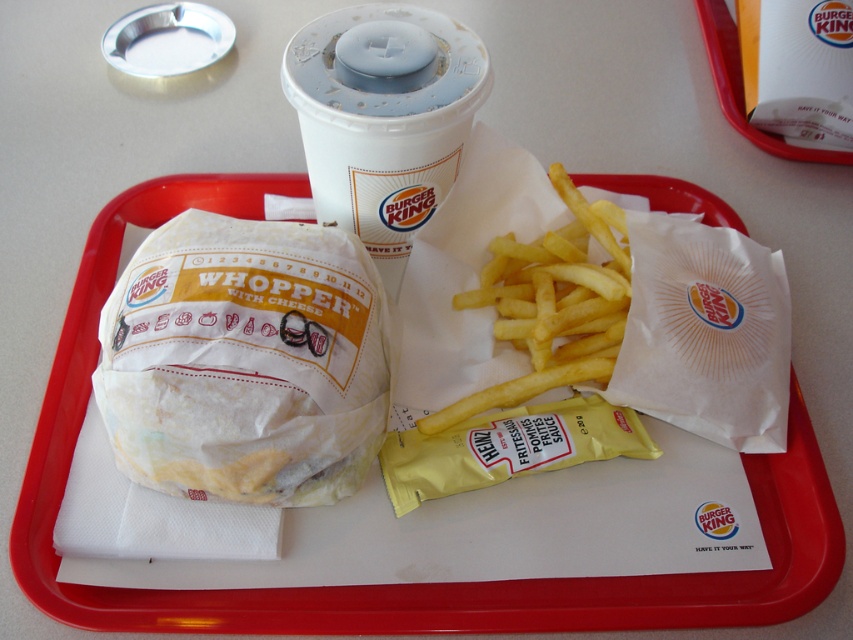
Can you confirm if white paper cup at upper center is positioned below golden crispy french fries at center?

Actually, white paper cup at upper center is above golden crispy french fries at center.

Between white paper cup at upper center and golden crispy french fries at center, which one appears on the right side from the viewer's perspective?

golden crispy french fries at center

Between point (331, 176) and point (553, 310), which one is positioned in front?

Point (331, 176) is more forward.

Find the location of a particular element. white paper cup at upper center is located at coordinates (383, 118).

Who is shorter, white paper whopper at left or golden crispy french fries at center?

With less height is golden crispy french fries at center.

Who is higher up, white paper whopper at left or golden crispy french fries at center?

golden crispy french fries at center is higher up.

Where is `white paper whopper at left`? The height and width of the screenshot is (640, 853). white paper whopper at left is located at coordinates (245, 362).

Is white paper whopper at left to the right of white paper cup at upper center from the viewer's perspective?

No, white paper whopper at left is not to the right of white paper cup at upper center.

Between white paper whopper at left and white paper cup at upper center, which one is positioned lower?

white paper whopper at left is below.

Identify the location of white paper whopper at left. This screenshot has width=853, height=640. (245, 362).

Locate an element on the screen. This screenshot has width=853, height=640. white paper whopper at left is located at coordinates (245, 362).